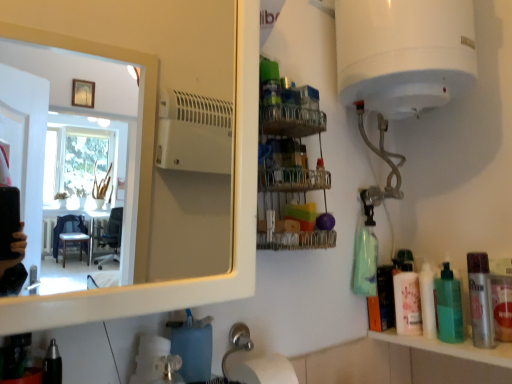
Question: Looking at the image, does matte white bottle at right seem bigger or smaller compared to green translucent bottle at right, which appears as the 2th mouthwash when viewed from the front?

Choices:
 (A) small
 (B) big

Answer: (A)

Question: Does point (434, 301) appear closer or farther from the camera than point (452, 283)?

Choices:
 (A) farther
 (B) closer

Answer: (B)

Question: Which object is the closest to the pink matte lotion at right, the 1th toiletry in the right-to-left sequence?

Choices:
 (A) matte white bottle at right
 (B) silver metallic mouthwash at right, the 2th mouthwash positioned from the back
 (C) white glossy mirror at upper left
 (D) metallic wire rack at upper center
 (E) green translucent bottle at right, which appears as the 2th mouthwash when viewed from the front

Answer: (A)

Question: Estimate the real-world distances between objects in this image. Which object is farther from the green translucent bottle at right, placed as the first mouthwash when sorted from back to front?

Choices:
 (A) pink matte lotion at right, the 1th toiletry in the right-to-left sequence
 (B) matte white bottle at right
 (C) black plastic pen at lower left, marked as the second toiletry in a back-to-front arrangement
 (D) silver metallic mouthwash at right, which appears as the 1th mouthwash when viewed from the front
 (E) white glossy mirror at upper left

Answer: (E)